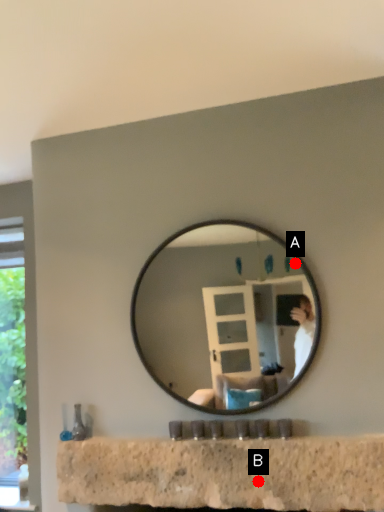
Question: Two points are circled on the image, labeled by A and B beside each circle. Which point is farther from the camera taking this photo?

Choices:
 (A) A is further
 (B) B is further

Answer: (A)